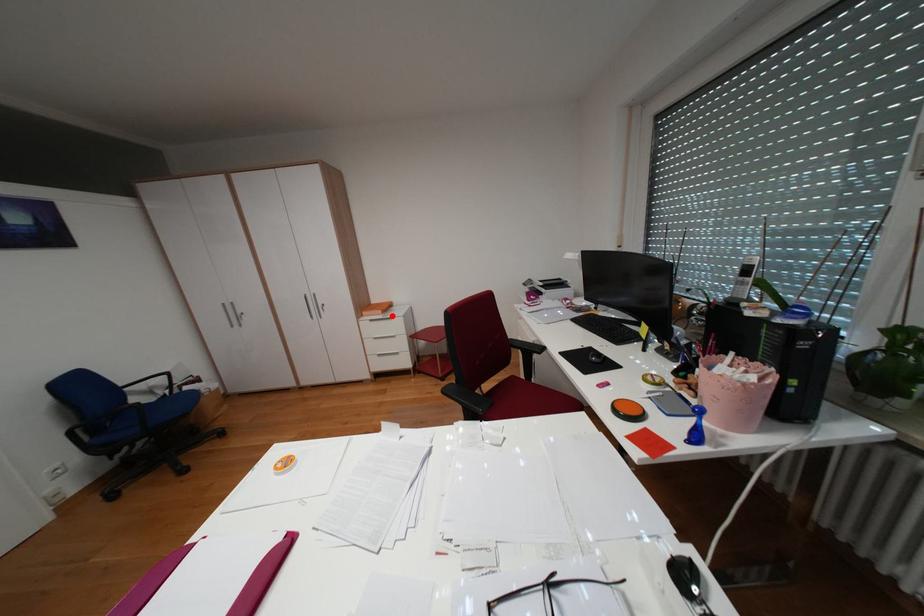
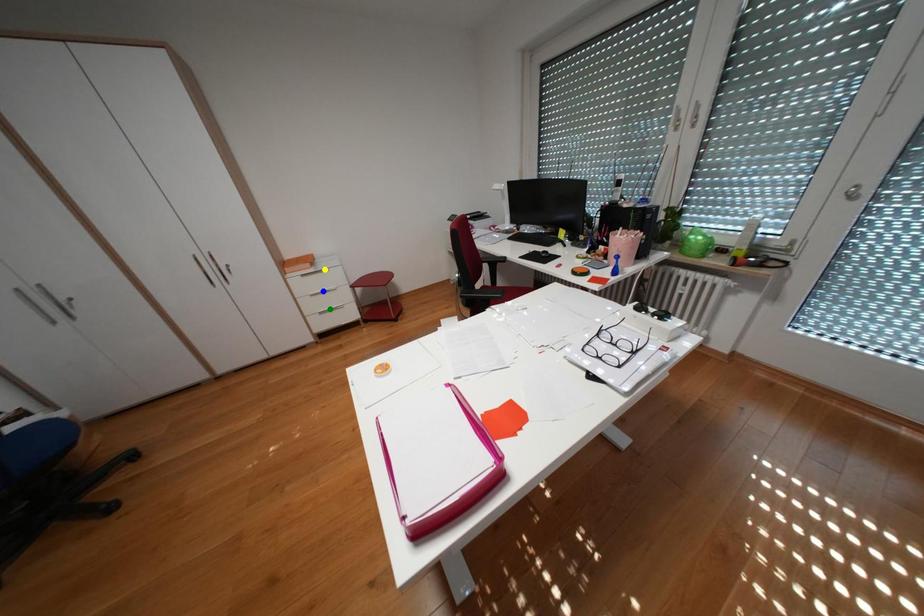
Question: I am providing you with two images of the same scene from different viewpoints. A red point is marked on the first image. You are given multiple points on the second image. Which point in image 2 is actually the same real-world point as the red point in image 1?

Choices:
 (A) blue point
 (B) green point
 (C) yellow point

Answer: (C)